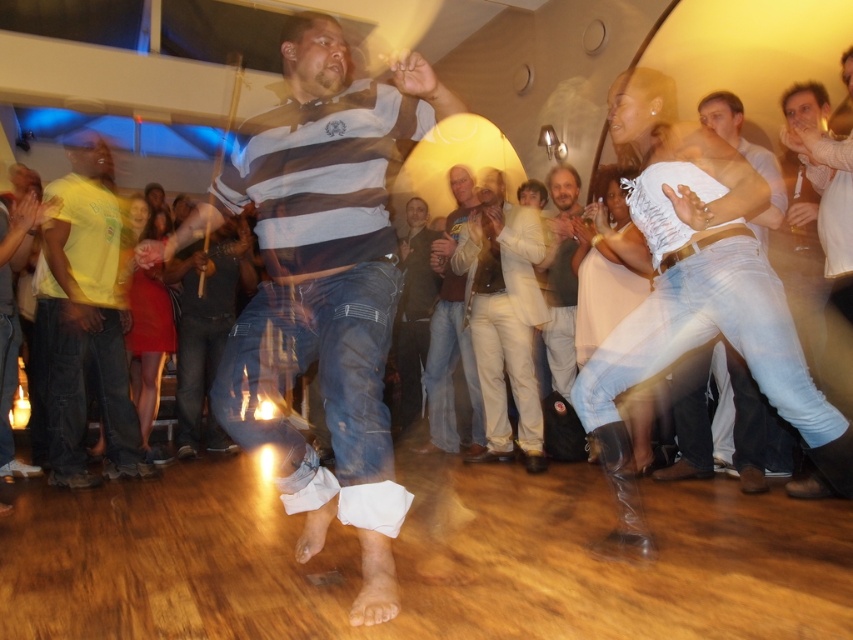
Which is in front, point (50, 186) or point (451, 333)?

Point (50, 186)

Is point (106, 291) closer to viewer compared to point (456, 300)?

Yes, it is.

Describe the element at coordinates (85, 323) in the screenshot. I see `yellow cotton shirt at left` at that location.

The height and width of the screenshot is (640, 853). Identify the location of yellow cotton shirt at left. (85, 323).

Between striped cotton shirt at center and dark brown leather jacket at center, which one is positioned higher?

Positioned higher is dark brown leather jacket at center.

The image size is (853, 640). What do you see at coordinates (322, 285) in the screenshot?
I see `striped cotton shirt at center` at bounding box center [322, 285].

What do you see at coordinates (322, 285) in the screenshot? I see `striped cotton shirt at center` at bounding box center [322, 285].

Locate an element on the screen. This screenshot has height=640, width=853. striped cotton shirt at center is located at coordinates (322, 285).

Can you confirm if light blue jeans at right is positioned above light brown leather jacket at center?

No, light blue jeans at right is not above light brown leather jacket at center.

Is light blue jeans at right thinner than light brown leather jacket at center?

In fact, light blue jeans at right might be wider than light brown leather jacket at center.

Between point (688, 406) and point (440, 356), which one is positioned behind?

The point (440, 356) is more distant.

The height and width of the screenshot is (640, 853). I want to click on light blue jeans at right, so click(724, 424).